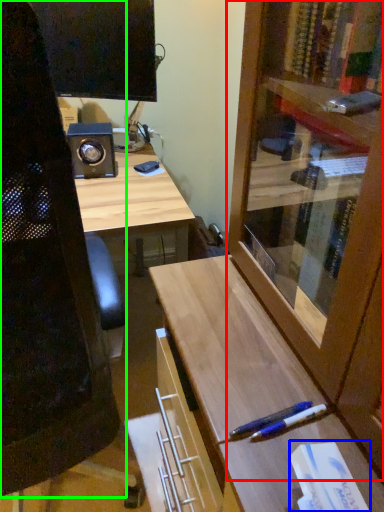
Question: Estimate the real-world distances between objects in this image. Which object is farther from cabinetry (highlighted by a red box), book (highlighted by a blue box) or computer chair (highlighted by a green box)?

Choices:
 (A) book
 (B) computer chair

Answer: (B)